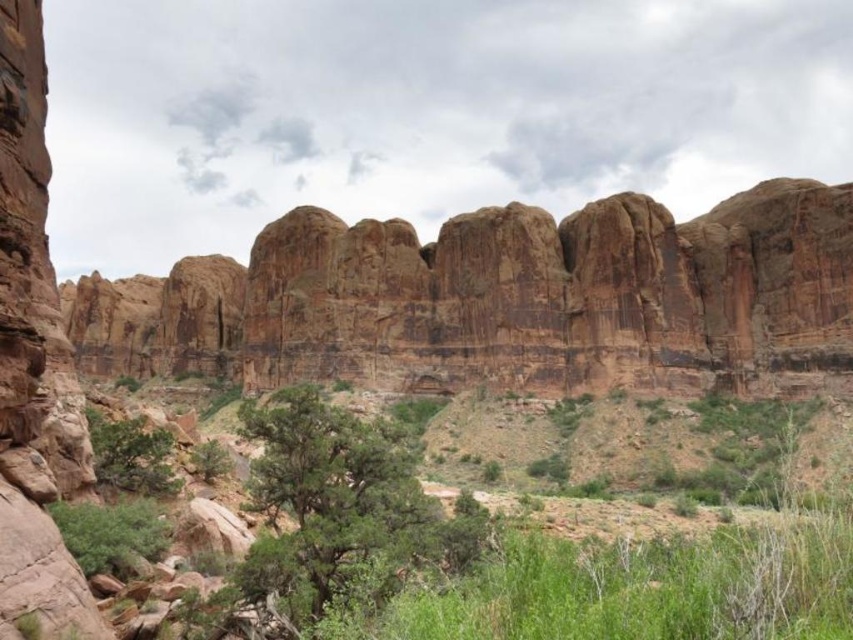
From the picture: You are a botanist studying plant growth in arid environments. You notice two plants in the scene. Which one is wider? The green leafy shrubs at center or the green leafy bush at lower left?

The green leafy shrubs at center are wider than the green leafy bush at lower left.